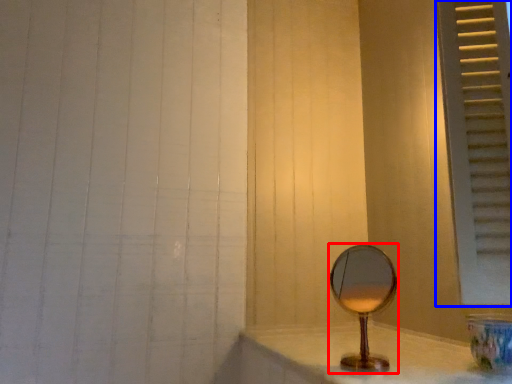
Question: Which object appears closest to the camera in this image, mirror (highlighted by a red box) or window frame (highlighted by a blue box)?

Choices:
 (A) mirror
 (B) window frame

Answer: (B)